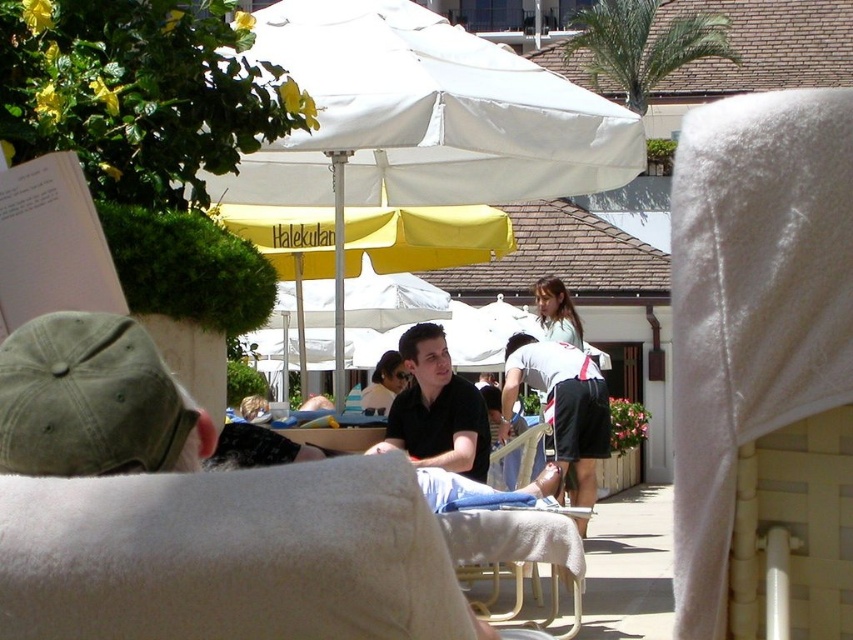
Between black matte shirt at center and light brown hair at center, which one appears on the left side from the viewer's perspective?

Positioned to the left is black matte shirt at center.

Is point (393, 440) positioned in front of point (543, 308)?

Yes, it is in front of point (543, 308).

In order to click on black matte shirt at center in this screenshot , I will do `click(436, 410)`.

Who is higher up, black matte shirt at center or white cotton shorts at center?

black matte shirt at center is higher up.

What do you see at coordinates (436, 410) in the screenshot? The image size is (853, 640). I see `black matte shirt at center` at bounding box center [436, 410].

You are a GUI agent. You are given a task and a screenshot of the screen. Output one action in this format:
    pyautogui.click(x=<x>, y=<y>)
    Task: Click on the black matte shirt at center
    The width and height of the screenshot is (853, 640).
    Given the screenshot: What is the action you would take?
    pyautogui.click(x=436, y=410)

Between white cotton shorts at center and light brown hair at center, which one appears on the left side from the viewer's perspective?

Positioned to the left is white cotton shorts at center.

Who is taller, white cotton shorts at center or light brown hair at center?

Standing taller between the two is white cotton shorts at center.

Is point (556, 394) more distant than point (572, 314)?

That is False.

Image resolution: width=853 pixels, height=640 pixels. Identify the location of white cotton shorts at center. (561, 404).